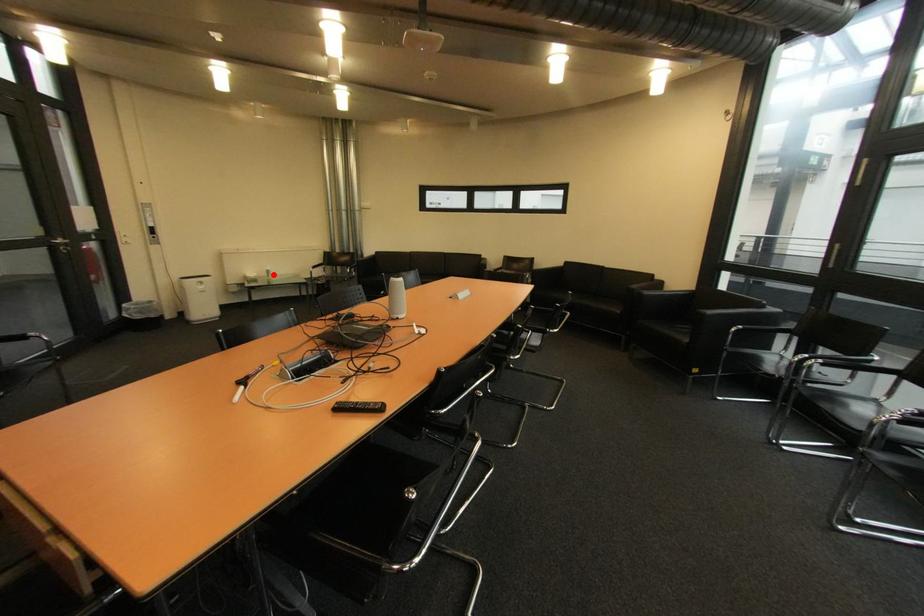
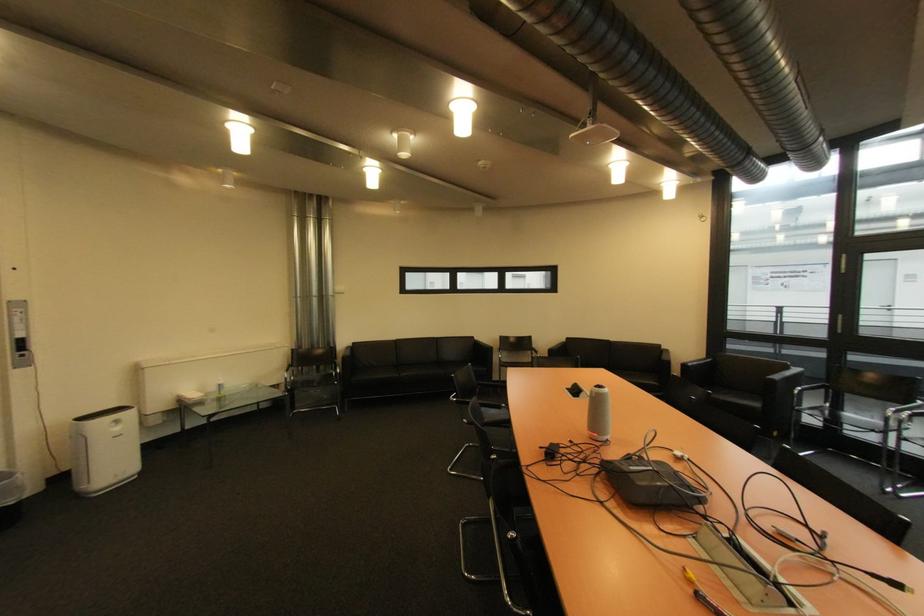
Find the pixel in the second image that matches the highlighted location in the first image.

(223, 391)